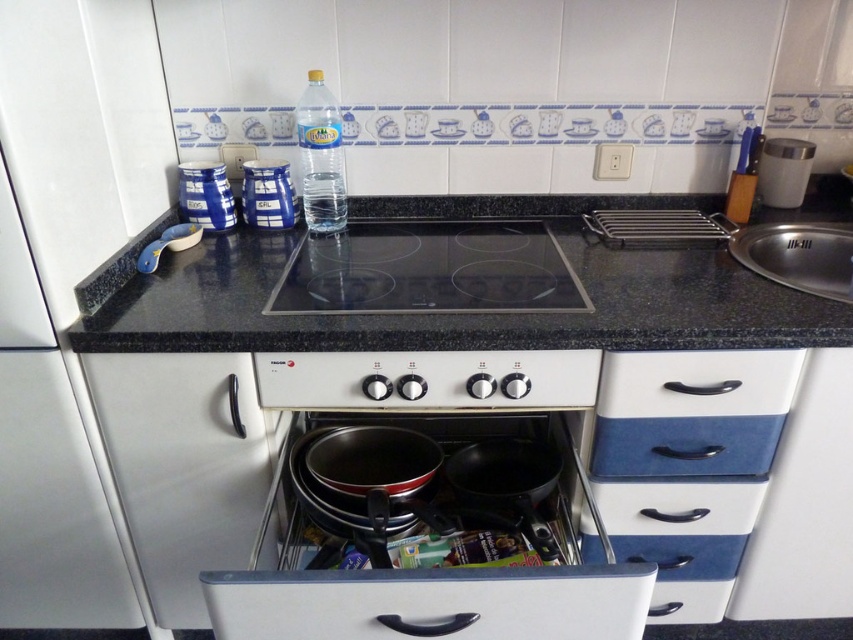
Question: Is granite/black at center to the right of clear plastic bottle at center from the viewer's perspective?

Choices:
 (A) no
 (B) yes

Answer: (B)

Question: Is granite black countertop at center bigger than blue glossy canister at upper left?

Choices:
 (A) yes
 (B) no

Answer: (A)

Question: Which object is positioned closest to the granite/black at center?

Choices:
 (A) blue glossy drawer at lower right
 (B) blue glossy canister at center
 (C) blue glossy canister at upper left

Answer: (A)

Question: Considering the real-world distances, which object is farthest from the blue glossy canister at upper left?

Choices:
 (A) granite/black at center
 (B) blue glossy canister at center
 (C) blue glossy drawer at lower right
 (D) stainless steel sink at upper right

Answer: (D)

Question: Can you confirm if black glass cooktop at center is positioned to the right of blue glossy drawer at lower right?

Choices:
 (A) no
 (B) yes

Answer: (A)

Question: Which object is farther from the camera taking this photo?

Choices:
 (A) clear plastic bottle at center
 (B) black glass cooktop at center

Answer: (A)